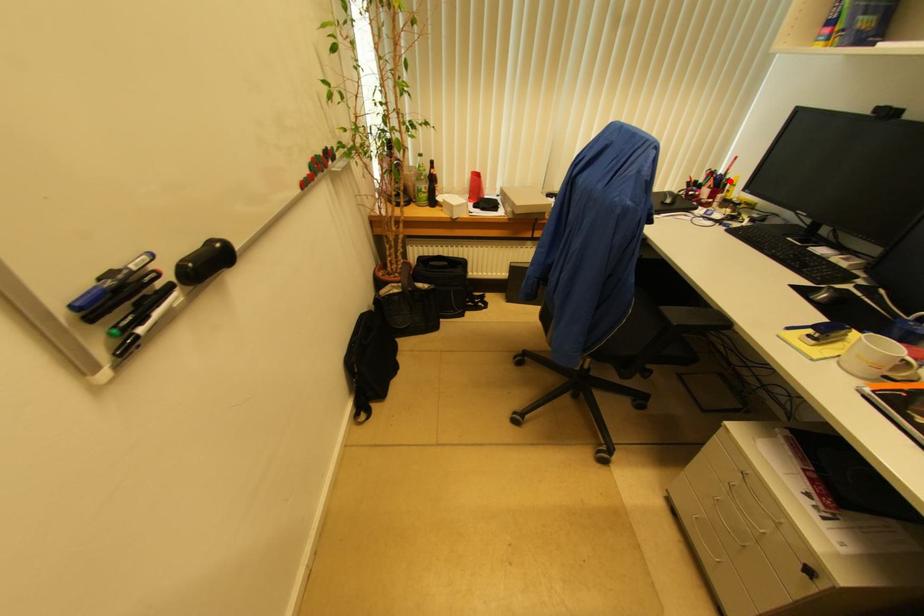
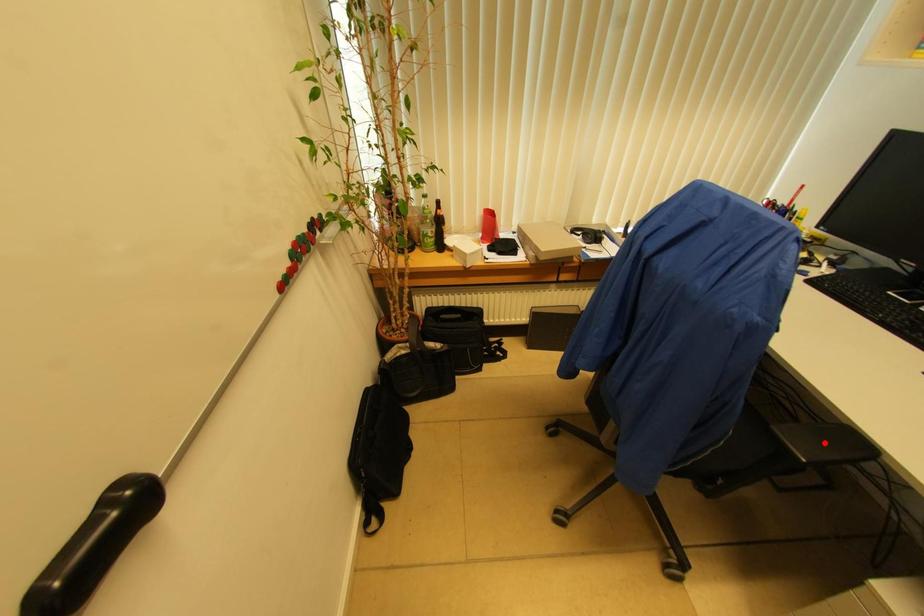
I am providing you with two images of the same scene from different viewpoints. A red point is marked on the first image and another point is marked on the second image. Do the highlighted points in image1 and image2 indicate the same real-world spot?

No